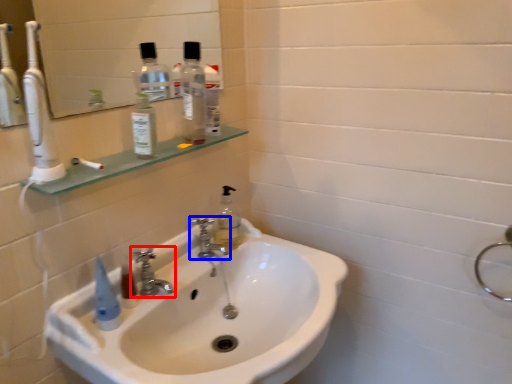
Question: Which object is further to the camera taking this photo, tap (highlighted by a red box) or tap (highlighted by a blue box)?

Choices:
 (A) tap
 (B) tap

Answer: (B)